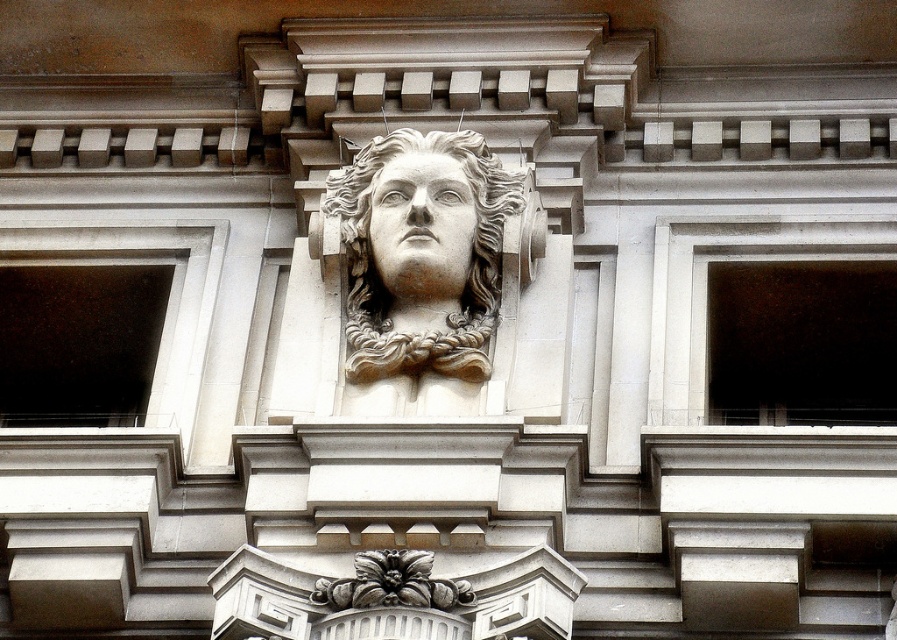
You are standing in front of a building with a sculpted bust on its facade. To your left, there is a transparent glass window at left. If you want to take a photo of the window without including the building facade, how far back should you move?

The transparent glass window at left is 247.59 feet away from the viewer. To ensure the window is captured without the building facade in the frame, you should move back approximately 247.59 feet.

You are an art conservator examining the building facade. You notice the stone sculpture at center and the transparent glass window at left. Which object is closer to you from your vantage point?

The stone sculpture at center is closer to you than the transparent glass window at left since it is positioned in front of it.

You are an architect examining the building facade. You notice the dark glass window at right and the white marble face at center. Which object is located to the right of the other?

The dark glass window at right is positioned on the right side of white marble face at center, so it is located to the right of the white marble face at center.